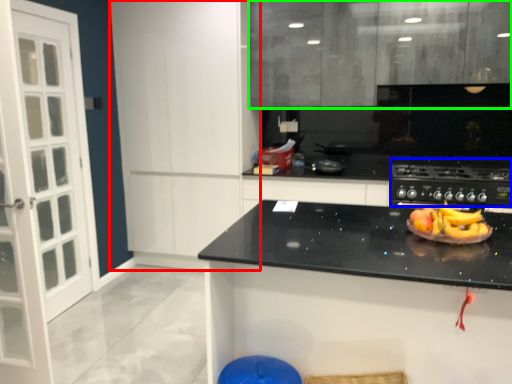
Question: Based on their relative distances, which object is nearer to cabinetry (highlighted by a red box)? Choose from gas stove (highlighted by a blue box) and cabinetry (highlighted by a green box).

Choices:
 (A) gas stove
 (B) cabinetry

Answer: (B)